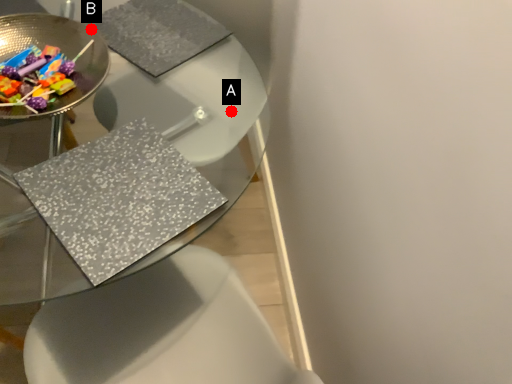
Question: Two points are circled on the image, labeled by A and B beside each circle. Which point appears closest to the camera in this image?

Choices:
 (A) A is closer
 (B) B is closer

Answer: (B)